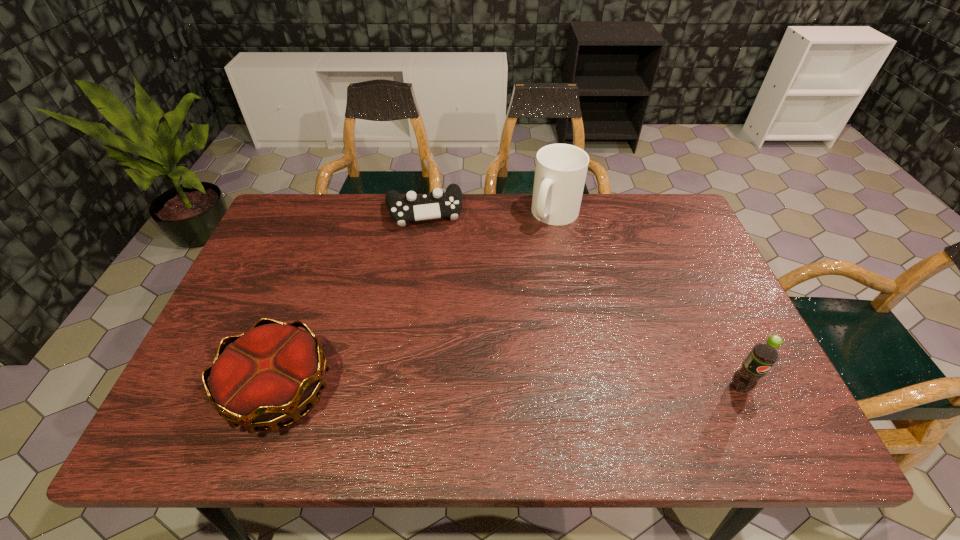
I want to click on vacant position located on the handle side of the mug, so click(506, 322).

The height and width of the screenshot is (540, 960). Identify the location of vacant space located on the handle side of the mug. (527, 278).

Where is `free spot located on the handle side of the mug`? Image resolution: width=960 pixels, height=540 pixels. free spot located on the handle side of the mug is located at coordinates tap(539, 255).

This screenshot has width=960, height=540. I want to click on control at the far edge, so click(x=413, y=207).

Where is `mug located at the far edge`? This screenshot has height=540, width=960. mug located at the far edge is located at coordinates (560, 172).

At what (x,y) coordinates should I click in order to perform the action: click on crown that is at the near edge. Please return your answer as a coordinate pair (x, y). Image resolution: width=960 pixels, height=540 pixels. Looking at the image, I should click on (268, 374).

Find the location of a particular element. The image size is (960, 540). soda that is at the near edge is located at coordinates tap(763, 355).

Image resolution: width=960 pixels, height=540 pixels. In order to click on object located in the left edge section of the desktop in this screenshot , I will do `click(268, 374)`.

Image resolution: width=960 pixels, height=540 pixels. I want to click on object that is at the right edge, so click(x=763, y=355).

You are a GUI agent. You are given a task and a screenshot of the screen. Output one action in this format:
    pyautogui.click(x=<x>, y=<y>)
    Task: Click on the object at the near left corner
    
    Given the screenshot: What is the action you would take?
    pyautogui.click(x=268, y=374)